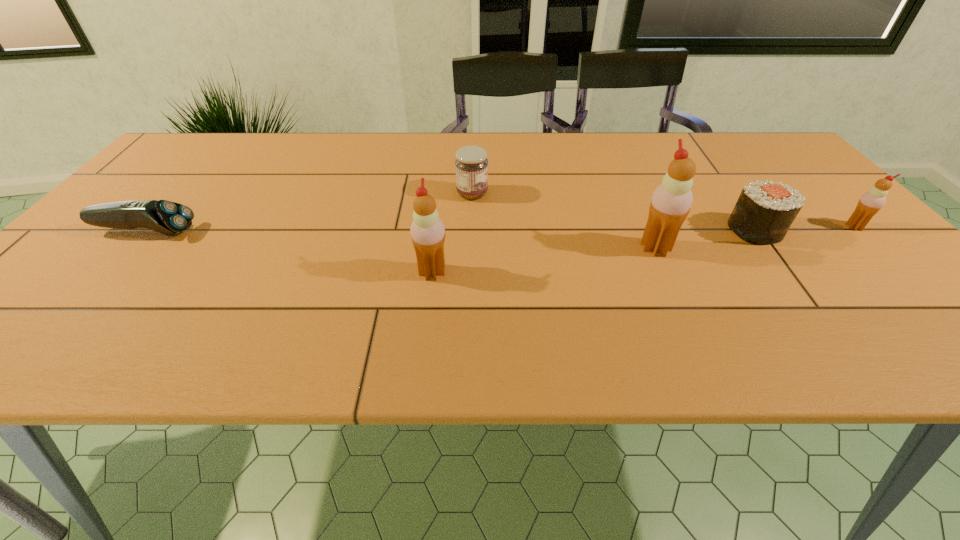
Where is `free spot that satisfies the following two spatial constraints: 1. on the front label of the farthest object; 2. on the left side of the fifth object from left to right`? The image size is (960, 540). free spot that satisfies the following two spatial constraints: 1. on the front label of the farthest object; 2. on the left side of the fifth object from left to right is located at coordinates (471, 230).